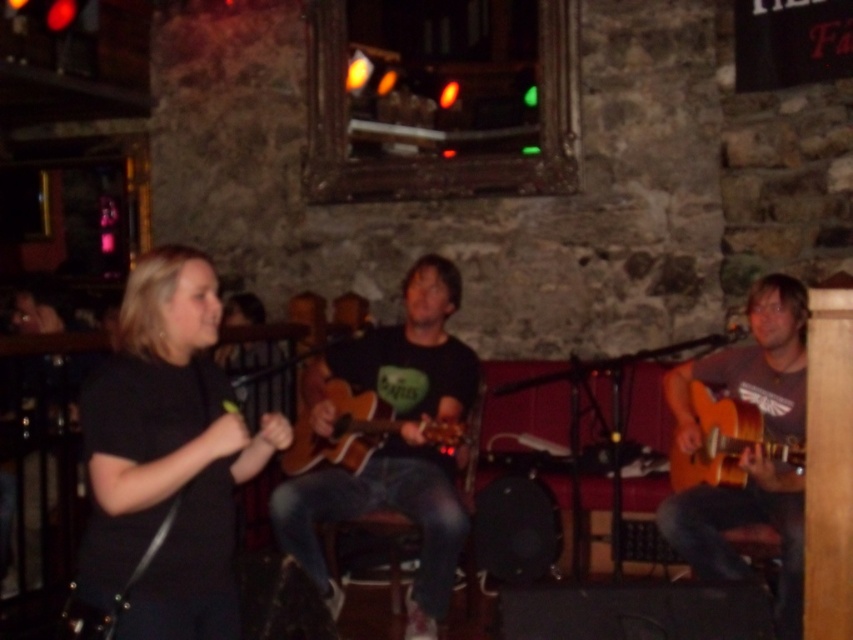
You are a stagehand setting up for a performance. You have two guitars on stage, a matte black guitar at center and a wooden acoustic guitar at center. The lead guitarist needs the bigger one for their performance. Which guitar should you hand them?

The lead guitarist should be handed the matte black guitar at center because it has a larger size compared to the wooden acoustic guitar at center.

You are setting up a music stand for the singer. The stand can only hold items narrower than the wooden acoustic guitar at center. Can the matte brown guitar at center fit on the stand?

The matte brown guitar at center might be wider than the wooden acoustic guitar at center, so it may not fit on the stand if the stand can only hold items narrower than the wooden acoustic guitar at center.

You are a photographer standing at the back of the venue and want to take a photo of both the matte black guitar at center and the wooden acoustic guitar at center. Which guitar will appear closer to you in the photo?

The matte black guitar at center will appear closer to you in the photo because it is positioned further to the viewer than the wooden acoustic guitar at center.